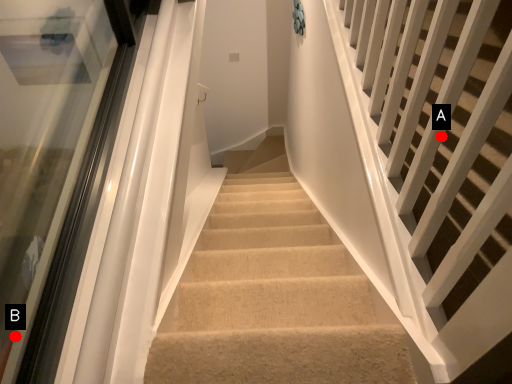
Question: Two points are circled on the image, labeled by A and B beside each circle. Which point is closer to the camera?

Choices:
 (A) A is closer
 (B) B is closer

Answer: (A)